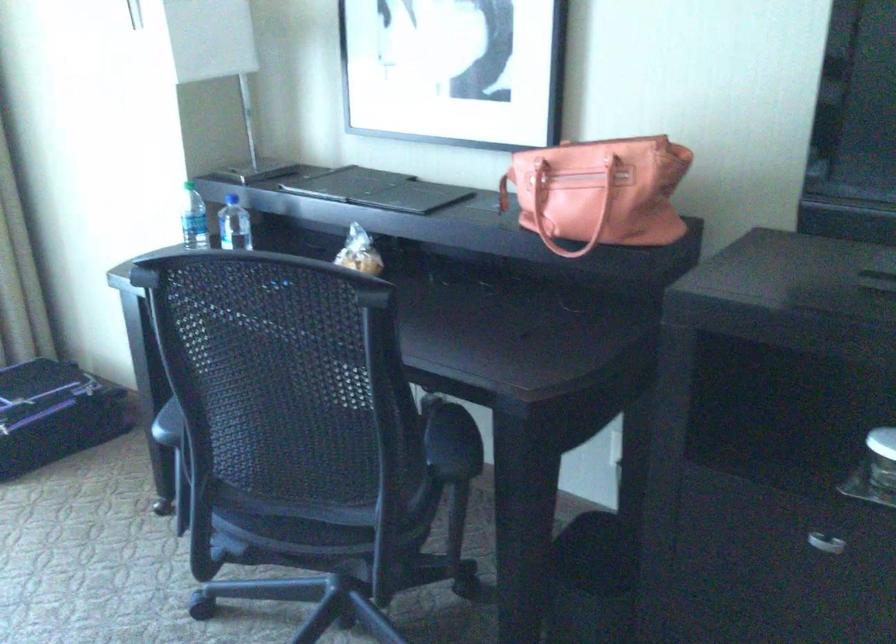
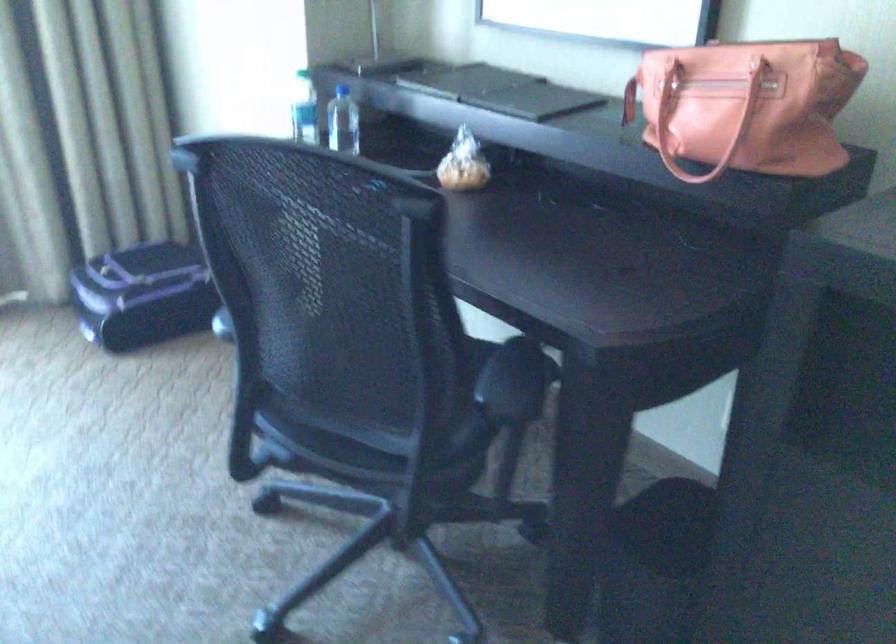
Question: The camera is either moving clockwise (left) or counter-clockwise (right) around the object. The first image is from the beginning of the video and the second image is from the end. Is the camera moving left or right when shooting the video?

Choices:
 (A) Left
 (B) Right

Answer: (B)